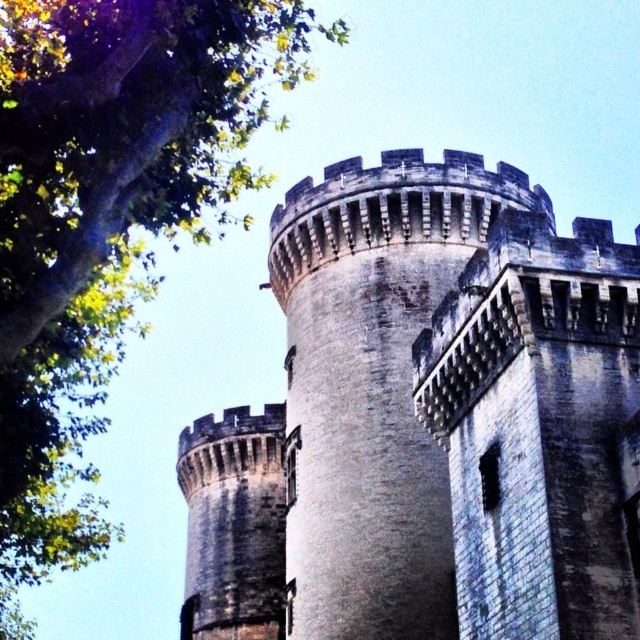
You are an architect analyzing the image of a medieval stone structure. You notice the gray stone castle at center and the green leafy tree at upper left. Which object takes up more area in the image?

The green leafy tree at upper left occupies more space than the gray stone castle at center in the image.

You are an architect analyzing the medieval structure. Based on the scene, which object is shorter between the gray stone castle at center and the green leafy tree at upper left?

The gray stone castle at center is shorter than the green leafy tree at upper left according to the description.

You are an architect examining this medieval scene. You need to determine the spatial relationship between the gray stone castle at center and the green leafy tree at upper left. Which object is positioned to the right of the other?

The gray stone castle at center is to the right of green leafy tree at upper left.